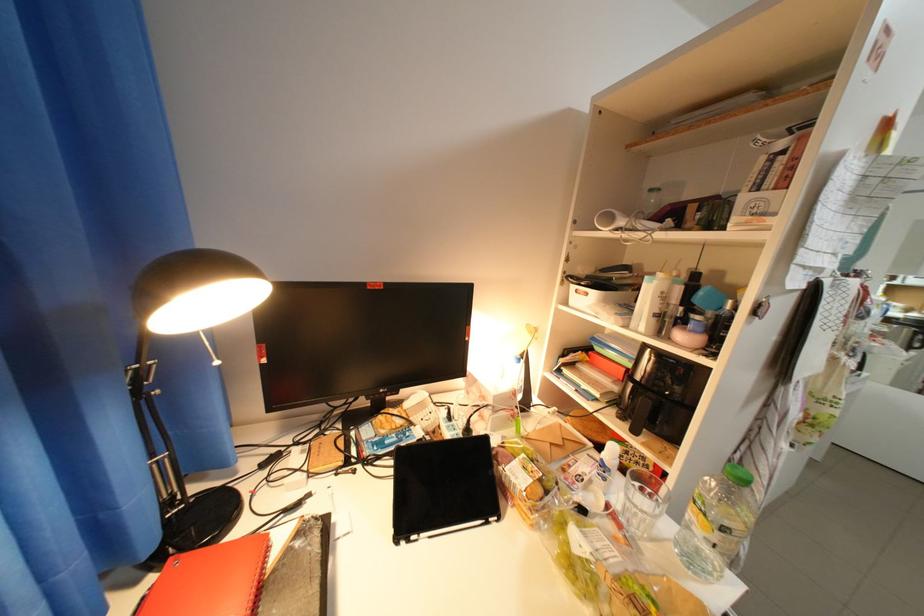
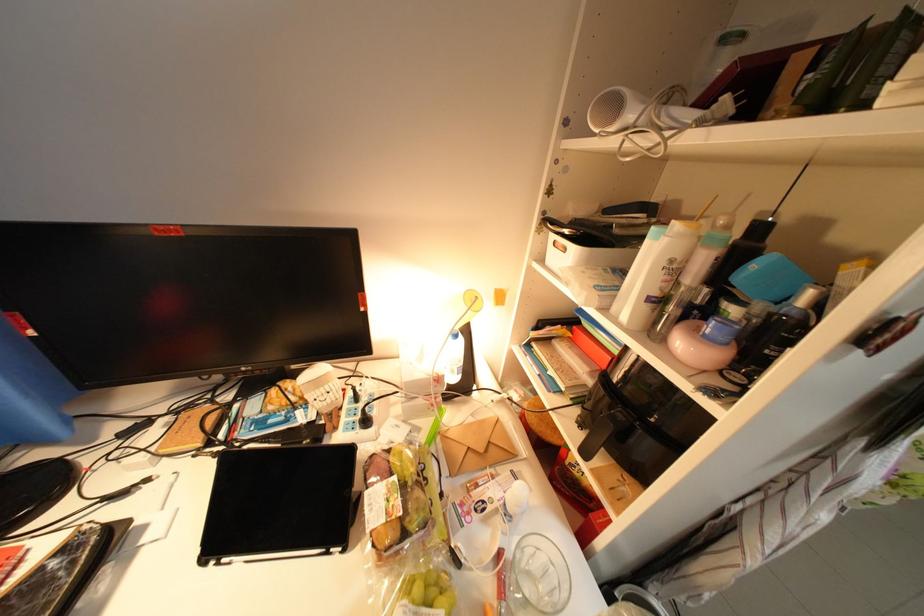
In the second image, find the point that corresponds to [691,337] in the first image.

(693, 344)